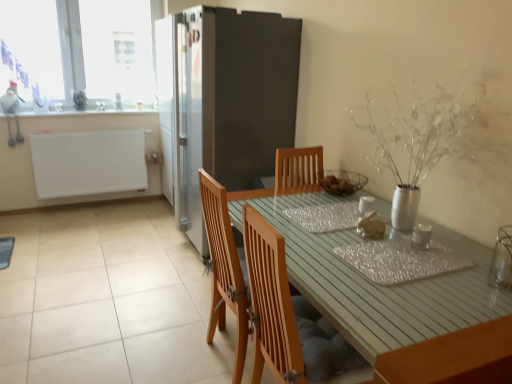
The image size is (512, 384). Find the location of `blank space to the left of matte gold bunny at center`. blank space to the left of matte gold bunny at center is located at coordinates (342, 240).